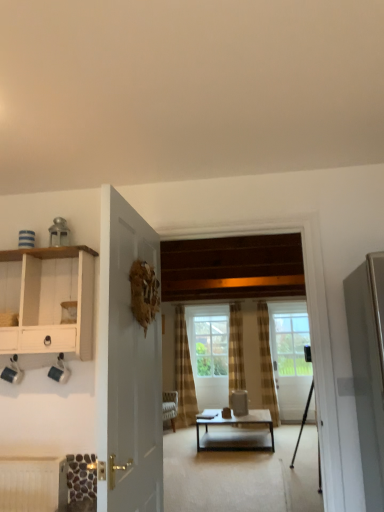
Where is `clear glass door at center, the 2th door in the top-to-bottom sequence`? This screenshot has height=512, width=384. clear glass door at center, the 2th door in the top-to-bottom sequence is located at coordinates (290, 357).

What do you see at coordinates (52, 301) in the screenshot? Image resolution: width=384 pixels, height=512 pixels. I see `white wood cabinet at left` at bounding box center [52, 301].

At what (x,y) coordinates should I click in order to perform the action: click on clear glass door at center, acting as the 2th door starting from the front. Please return your answer as a coordinate pair (x, y). The height and width of the screenshot is (512, 384). Looking at the image, I should click on (290, 357).

From the image's perspective, is clear glass door at center, positioned as the second door in left-to-right order, on top of white wood cabinet at left?

No, from the image's perspective, clear glass door at center, positioned as the second door in left-to-right order, is not above white wood cabinet at left.

Find the location of a particular element. This screenshot has height=512, width=384. the 2nd door counting from the right side of the white wood cabinet at left is located at coordinates 290,357.

Is clear glass door at center, the 2th door in the top-to-bottom sequence, far from white wood cabinet at left?

Yes, clear glass door at center, the 2th door in the top-to-bottom sequence, and white wood cabinet at left are quite far apart.

In the image, is clear glass door at center, acting as the 2th door starting from the front, on the left side or the right side of white wood cabinet at left?

From the image, it's evident that clear glass door at center, acting as the 2th door starting from the front, is to the right of white wood cabinet at left.

Does clear glass door at center, the 2th door in the top-to-bottom sequence, lie behind plaid fabric curtain at center?

No.

Looking at this image, who is smaller, clear glass door at center, positioned as the first door in back-to-front order, or plaid fabric curtain at center?

clear glass door at center, positioned as the first door in back-to-front order.

Identify the location of curtain lying on the left of clear glass door at center, positioned as the first door in right-to-left order. The image size is (384, 512). (184, 373).

From the picture: Between clear glass door at center, the 2th door in the top-to-bottom sequence, and matte black coffee table at center, which one appears on the right side from the viewer's perspective?

clear glass door at center, the 2th door in the top-to-bottom sequence.

Are clear glass door at center, acting as the 2th door starting from the front, and matte black coffee table at center far apart?

Yes.

Does clear glass door at center, acting as the 2th door starting from the front, have a lesser width compared to matte black coffee table at center?

Correct, the width of clear glass door at center, acting as the 2th door starting from the front, is less than that of matte black coffee table at center.

Is clear glass door at center, the 2th door in the top-to-bottom sequence, inside the boundaries of matte black coffee table at center, or outside?

clear glass door at center, the 2th door in the top-to-bottom sequence, is spatially situated outside matte black coffee table at center.

Does plaid fabric curtain at center turn towards white wood cabinet at left?

Yes, plaid fabric curtain at center is oriented towards white wood cabinet at left.

The image size is (384, 512). I want to click on cabinetry in front of the plaid fabric curtain at center, so click(x=52, y=301).

Measure the distance from plaid fabric curtain at center to white wood cabinet at left.

14.03 feet.

Who is more distant, plaid fabric curtain at center or white wood cabinet at left?

plaid fabric curtain at center is behind.

From the picture: Which object is positioned more to the right, white glossy door at center, the second door viewed from the right, or clear glass window at center?

Positioned to the right is clear glass window at center.

Is there a large distance between white glossy door at center, which appears as the 2th door when viewed from the back, and clear glass window at center?

That's right, there is a large distance between white glossy door at center, which appears as the 2th door when viewed from the back, and clear glass window at center.

What's the angular difference between white glossy door at center, placed as the 1th door when sorted from top to bottom, and clear glass window at center's facing directions?

They differ by 90.2 degrees in their facing directions.

Who is shorter, white glossy door at center, placed as the 1th door when sorted from top to bottom, or clear glass window at center?

With less height is clear glass window at center.

Considering the relative positions of white wood cabinet at left and matte black coffee table at center in the image provided, is white wood cabinet at left in front of matte black coffee table at center?

Yes, white wood cabinet at left is closer to the viewer.

From a real-world perspective, is white wood cabinet at left beneath matte black coffee table at center?

No, from a real-world perspective, white wood cabinet at left is not under matte black coffee table at center.

Considering the positions of point (93, 301) and point (264, 423), is point (93, 301) closer or farther from the camera than point (264, 423)?

Point (93, 301) is positioned closer to the camera compared to point (264, 423).

Considering the relative sizes of white wood cabinet at left and matte black coffee table at center in the image provided, is white wood cabinet at left wider than matte black coffee table at center?

Incorrect, the width of white wood cabinet at left does not surpass that of matte black coffee table at center.

Which is closer, (x=311, y=382) or (x=175, y=384)?

Clearly, point (x=311, y=382) is more distant from the camera than point (x=175, y=384).

Is plaid fabric curtain at center located within metallic tripod at center?

No, metallic tripod at center does not contain plaid fabric curtain at center.

Considering the relative positions of metallic tripod at center and plaid fabric curtain at center in the image provided, is metallic tripod at center in front of plaid fabric curtain at center?

Yes, it is.

The image size is (384, 512). I want to click on cabinetry above the clear glass door at center, positioned as the second door in left-to-right order (from a real-world perspective), so pos(52,301).

From the plaid fabric curtain at center, count 1st doors forward and point to it. Please provide its 2D coordinates.

[(290, 357)]

Looking at the image, which one is located closer to metallic tripod at center, white glossy door at center, which appears as the 2th door when viewed from the back, or matte black coffee table at center?

matte black coffee table at center is closer to metallic tripod at center.

Which object lies nearer to the anchor point white glossy door at center, which is the first door from left to right, clear glass door at center, positioned as the first door in back-to-front order, or plaid fabric curtain at center?

The object closer to white glossy door at center, which is the first door from left to right, is plaid fabric curtain at center.

When comparing their distances from metallic tripod at center, does clear glass window at center or plaid fabric curtain at center seem further?

plaid fabric curtain at center lies further to metallic tripod at center than the other object.

Considering their positions, is white wood cabinet at left positioned closer to plaid fabric curtain at center than metallic tripod at center?

metallic tripod at center lies closer to plaid fabric curtain at center than the other object.

In the scene shown: From the image, which object appears to be nearer to matte black coffee table at center, clear glass window at center or white wood cabinet at left?

clear glass window at center lies closer to matte black coffee table at center than the other object.

When comparing their distances from white wood cabinet at left, does plaid fabric curtain at center or matte black coffee table at center seem closer?

The object closer to white wood cabinet at left is matte black coffee table at center.

When comparing their distances from clear glass door at center, positioned as the second door in left-to-right order, does metallic tripod at center or plaid fabric curtain at center seem closer?

→ Based on the image, metallic tripod at center appears to be nearer to clear glass door at center, positioned as the second door in left-to-right order.

Estimate the real-world distances between objects in this image. Which object is closer to matte black coffee table at center, white wood cabinet at left or clear glass door at center, positioned as the first door in right-to-left order?

clear glass door at center, positioned as the first door in right-to-left order, lies closer to matte black coffee table at center than the other object.

The image size is (384, 512). What are the coordinates of `door located between metallic tripod at center and plaid fabric curtain at center in the depth direction` in the screenshot? It's located at pos(290,357).

Find the location of a particular element. The image size is (384, 512). door located between white wood cabinet at left and plaid fabric curtain at center in the depth direction is located at coordinates (290, 357).

In order to click on door located between white wood cabinet at left and clear glass window at center in the depth direction in this screenshot , I will do `click(290, 357)`.

I want to click on coffee table between white glossy door at center, the second door viewed from the right, and plaid fabric curtain at center from front to back, so (238, 432).